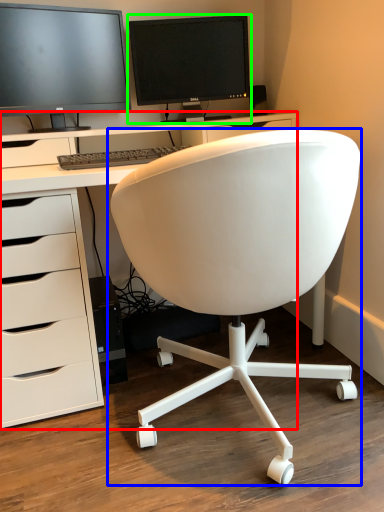
Question: Which object is positioned farthest from desk (highlighted by a red box)? Select from chair (highlighted by a blue box) and computer monitor (highlighted by a green box).

Choices:
 (A) chair
 (B) computer monitor

Answer: (B)